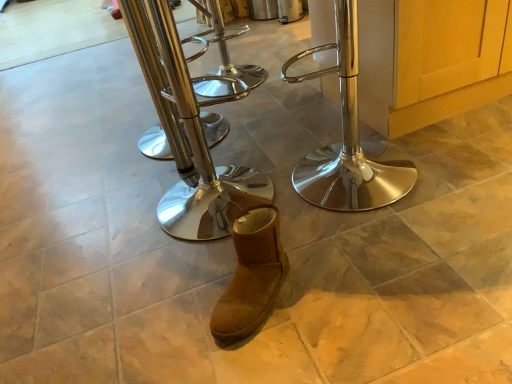
I want to click on free space that is in between polished metal bar stool at center, which is the 1th step stool from left to right, and polished chrome stool at center, the second step stool when ordered from left to right, so click(192, 167).